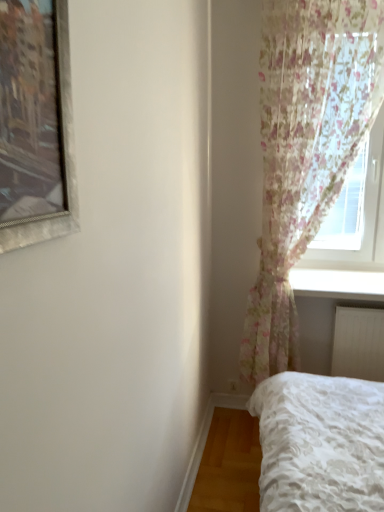
Question: Is white plastic radiator at lower right spatially inside white glossy window sill at lower right, or outside of it?

Choices:
 (A) outside
 (B) inside

Answer: (A)

Question: From a real-world perspective, is white plastic radiator at lower right physically located above or below white glossy window sill at lower right?

Choices:
 (A) above
 (B) below

Answer: (B)

Question: Estimate the real-world distances between objects in this image. Which object is closer to the floral sheer curtain at right?

Choices:
 (A) white plastic radiator at lower right
 (B) white glossy window sill at lower right

Answer: (B)

Question: Which of these objects is positioned closest to the white plastic radiator at lower right?

Choices:
 (A) floral sheer curtain at right
 (B) white glossy window sill at lower right

Answer: (B)